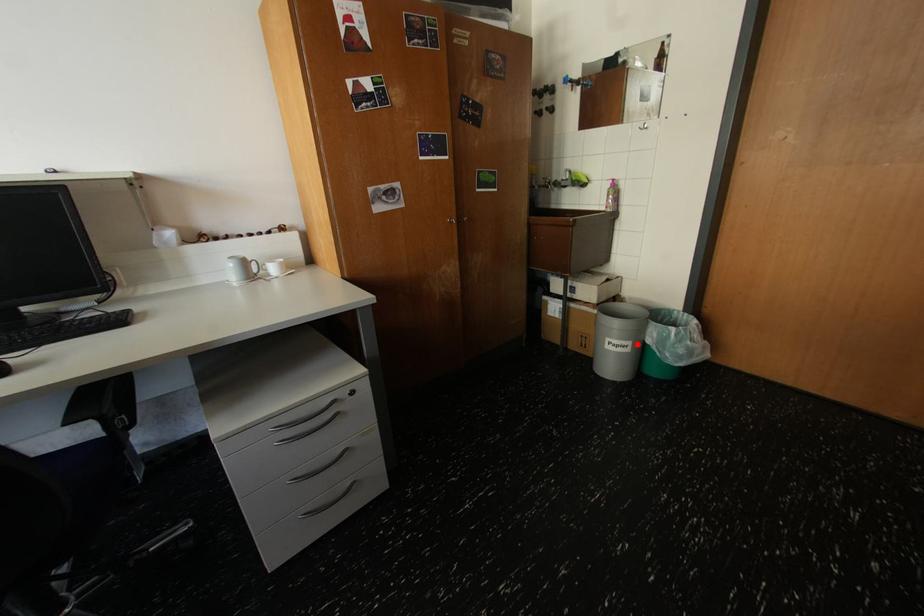
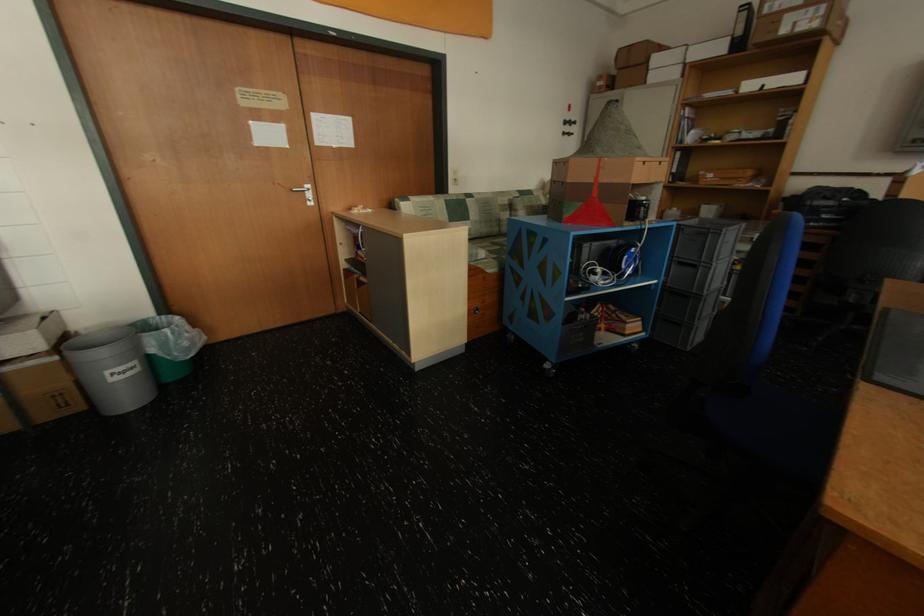
Question: A red point is marked in image1. In image2, is the corresponding 3D point closer to the camera or farther? Reply with the corresponding letter.

Choices:
 (A) The corresponding 3D point is closer.
 (B) The corresponding 3D point is farther.

Answer: (A)